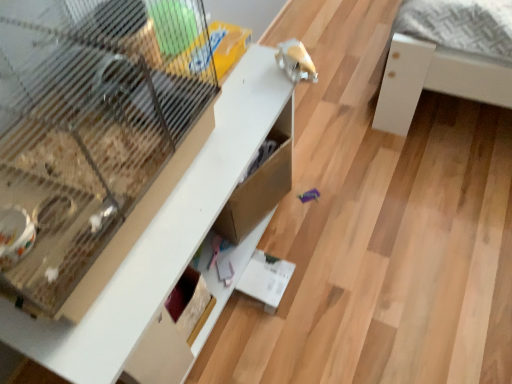
I want to click on free location to the right of white cardboard box at upper left, so click(x=376, y=234).